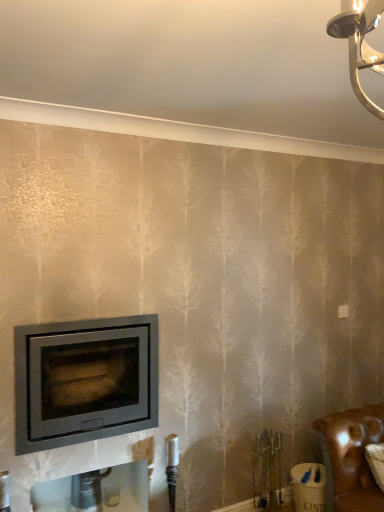
The height and width of the screenshot is (512, 384). What do you see at coordinates (84, 380) in the screenshot? I see `matte gray wood burning stove at lower left` at bounding box center [84, 380].

Image resolution: width=384 pixels, height=512 pixels. Identify the location of matte gray wood burning stove at lower left. pyautogui.click(x=84, y=380).

Image resolution: width=384 pixels, height=512 pixels. What do you see at coordinates (351, 458) in the screenshot?
I see `brown leather couch at lower right` at bounding box center [351, 458].

Locate an element on the screen. The height and width of the screenshot is (512, 384). brown leather couch at lower right is located at coordinates (351, 458).

This screenshot has height=512, width=384. Identify the location of matte gray wood burning stove at lower left. (84, 380).

In the scene shown: Can you confirm if brown leather couch at lower right is positioned to the left of matte gray wood burning stove at lower left?

No.

Which is in front, brown leather couch at lower right or matte gray wood burning stove at lower left?

matte gray wood burning stove at lower left is closer to the camera.

Is point (361, 416) positioned in front of point (64, 404)?

No, it is not.

From the image's perspective, which one is positioned lower, brown leather couch at lower right or matte gray wood burning stove at lower left?

From the image's view, brown leather couch at lower right is below.

From a real-world perspective, is brown leather couch at lower right on matte gray wood burning stove at lower left?

No, from a real-world perspective, brown leather couch at lower right is not above matte gray wood burning stove at lower left.

Consider the image. Between brown leather couch at lower right and matte gray wood burning stove at lower left, which one has smaller width?

With smaller width is brown leather couch at lower right.

Considering the sizes of brown leather couch at lower right and matte gray wood burning stove at lower left in the image, is brown leather couch at lower right taller or shorter than matte gray wood burning stove at lower left?

brown leather couch at lower right is shorter than matte gray wood burning stove at lower left.

Which of these two, brown leather couch at lower right or matte gray wood burning stove at lower left, is bigger?

Bigger between the two is matte gray wood burning stove at lower left.

Can we say brown leather couch at lower right lies outside matte gray wood burning stove at lower left?

Absolutely, brown leather couch at lower right is external to matte gray wood burning stove at lower left.

Is brown leather couch at lower right in contact with matte gray wood burning stove at lower left?

No, brown leather couch at lower right is not with matte gray wood burning stove at lower left.

Could you tell me if brown leather couch at lower right is turned towards matte gray wood burning stove at lower left?

No, brown leather couch at lower right does not turn towards matte gray wood burning stove at lower left.

How far apart are brown leather couch at lower right and matte gray wood burning stove at lower left?

A distance of 1.24 meters exists between brown leather couch at lower right and matte gray wood burning stove at lower left.

What are the coordinates of `wood burning stove in front of the brown leather couch at lower right` in the screenshot? It's located at (84, 380).

Between matte gray wood burning stove at lower left and brown leather couch at lower right, which one appears on the left side from the viewer's perspective?

Positioned to the left is matte gray wood burning stove at lower left.

Which object is closer to the camera, matte gray wood burning stove at lower left or brown leather couch at lower right?

matte gray wood burning stove at lower left is more forward.

Considering the positions of points (29, 339) and (358, 466), is point (29, 339) closer to camera compared to point (358, 466)?

Yes, point (29, 339) is closer to viewer.

From the image's perspective, is matte gray wood burning stove at lower left located above or below brown leather couch at lower right?

Based on their image positions, matte gray wood burning stove at lower left is located above brown leather couch at lower right.

From a real-world perspective, which object stands above the other?

matte gray wood burning stove at lower left is physically above.

Which of these two, matte gray wood burning stove at lower left or brown leather couch at lower right, is thinner?

With smaller width is brown leather couch at lower right.

Which of these two, matte gray wood burning stove at lower left or brown leather couch at lower right, stands shorter?

With less height is brown leather couch at lower right.

Who is bigger, matte gray wood burning stove at lower left or brown leather couch at lower right?

With larger size is matte gray wood burning stove at lower left.

Based on the photo, could brown leather couch at lower right be considered to be inside matte gray wood burning stove at lower left?

Actually, brown leather couch at lower right is outside matte gray wood burning stove at lower left.

Would you consider matte gray wood burning stove at lower left to be distant from brown leather couch at lower right?

Yes, matte gray wood burning stove at lower left is far from brown leather couch at lower right.

Could you tell me if matte gray wood burning stove at lower left is turned towards brown leather couch at lower right?

No, matte gray wood burning stove at lower left is not turned towards brown leather couch at lower right.

How many degrees apart are the facing directions of matte gray wood burning stove at lower left and brown leather couch at lower right?

matte gray wood burning stove at lower left and brown leather couch at lower right are facing 4.38 degrees away from each other.

At what (x,y) coordinates should I click in order to perform the action: click on wood burning stove in front of the brown leather couch at lower right. Please return your answer as a coordinate pair (x, y). This screenshot has width=384, height=512. Looking at the image, I should click on (84, 380).

Locate an element on the screen. This screenshot has height=512, width=384. furniture below the matte gray wood burning stove at lower left (from a real-world perspective) is located at coordinates coord(351,458).

Find the location of a particular element. This screenshot has width=384, height=512. furniture lying below the matte gray wood burning stove at lower left (from the image's perspective) is located at coordinates (351, 458).